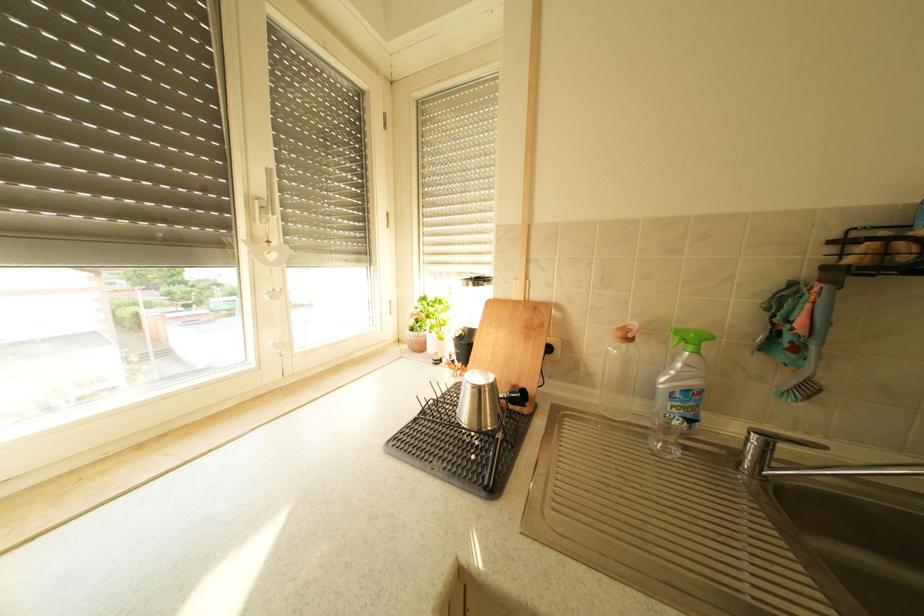
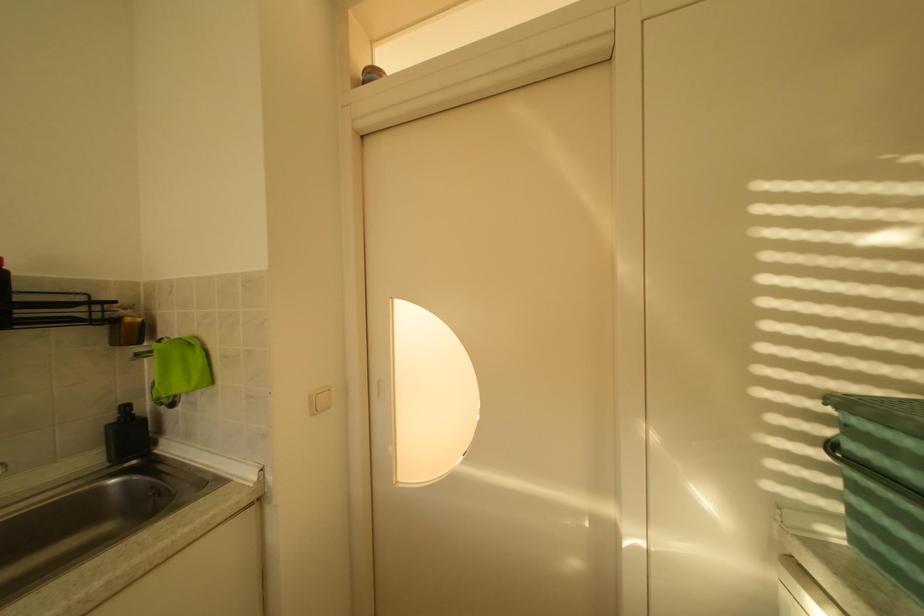
Question: Based on the continuous images, in which direction is the camera rotating? Reply with the corresponding letter.

Choices:
 (A) Left
 (B) Right
 (C) Up
 (D) Down

Answer: (B)